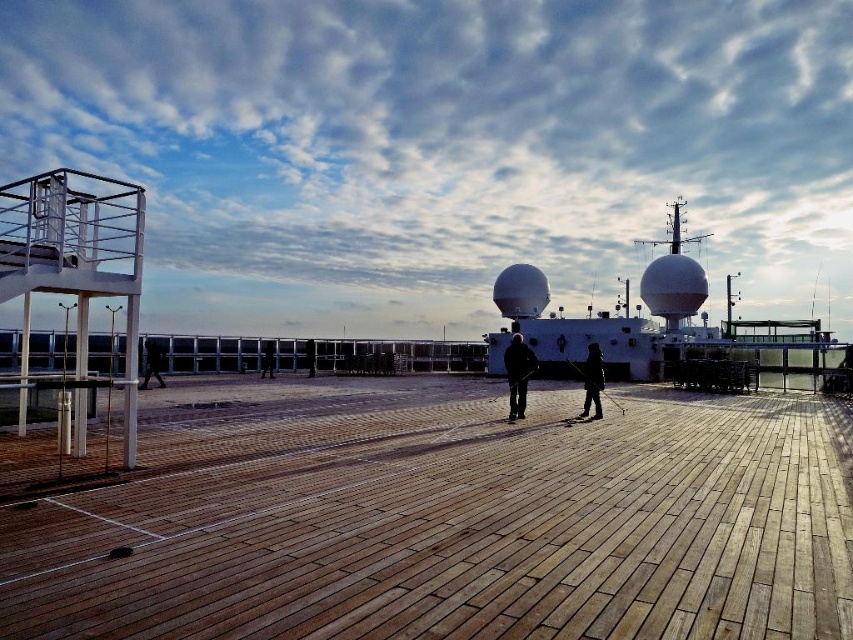
Can you confirm if dark fabric jacket at center is positioned to the right of black leather jacket at left?

Indeed, dark fabric jacket at center is positioned on the right side of black leather jacket at left.

Who is lower down, dark fabric jacket at center or black leather jacket at left?

black leather jacket at left is lower down.

What do you see at coordinates (592, 381) in the screenshot? Image resolution: width=853 pixels, height=640 pixels. I see `dark fabric jacket at center` at bounding box center [592, 381].

In order to click on dark fabric jacket at center in this screenshot , I will do `click(592, 381)`.

Can you confirm if dark fabric jacket at center is positioned to the left of black fabric person at center?

No, dark fabric jacket at center is not to the left of black fabric person at center.

Is dark fabric jacket at center positioned behind black fabric person at center?

No, dark fabric jacket at center is in front of black fabric person at center.

Who is more forward, (x=585, y=371) or (x=262, y=362)?

Point (x=585, y=371)

Image resolution: width=853 pixels, height=640 pixels. Identify the location of dark fabric jacket at center. (592, 381).

How much distance is there between wooden at center and black leather jacket at left?

wooden at center and black leather jacket at left are 13.27 meters apart.

Is wooden at center bigger than black leather jacket at left?

Yes, wooden at center is bigger than black leather jacket at left.

This screenshot has height=640, width=853. I want to click on wooden at center, so click(450, 520).